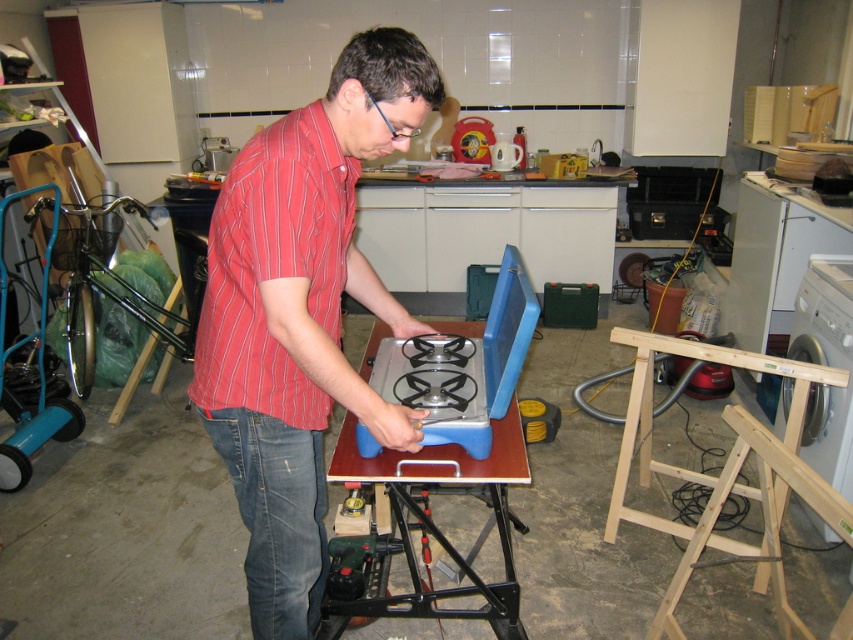
Is red striped shirt at center thinner than denim at left?

No, red striped shirt at center is not thinner than denim at left.

This screenshot has width=853, height=640. What do you see at coordinates (300, 314) in the screenshot? I see `red striped shirt at center` at bounding box center [300, 314].

Identify the location of red striped shirt at center. (300, 314).

Does red striped shirt at center have a larger size compared to blue plastic table at center?

Yes, red striped shirt at center is bigger than blue plastic table at center.

Which is in front, point (437, 83) or point (381, 605)?

Point (437, 83) is in front.

The image size is (853, 640). Identify the location of red striped shirt at center. 300,314.

Where is `red striped shirt at center`? This screenshot has height=640, width=853. red striped shirt at center is located at coordinates (300, 314).

Is red striped shirt at center to the left of blue plastic gas stove at center from the viewer's perspective?

Correct, you'll find red striped shirt at center to the left of blue plastic gas stove at center.

From the picture: Does red striped shirt at center appear under blue plastic gas stove at center?

No, red striped shirt at center is not below blue plastic gas stove at center.

Find the location of a particular element. red striped shirt at center is located at coordinates (300, 314).

Locate an element on the screen. Image resolution: width=853 pixels, height=640 pixels. red striped shirt at center is located at coordinates (300, 314).